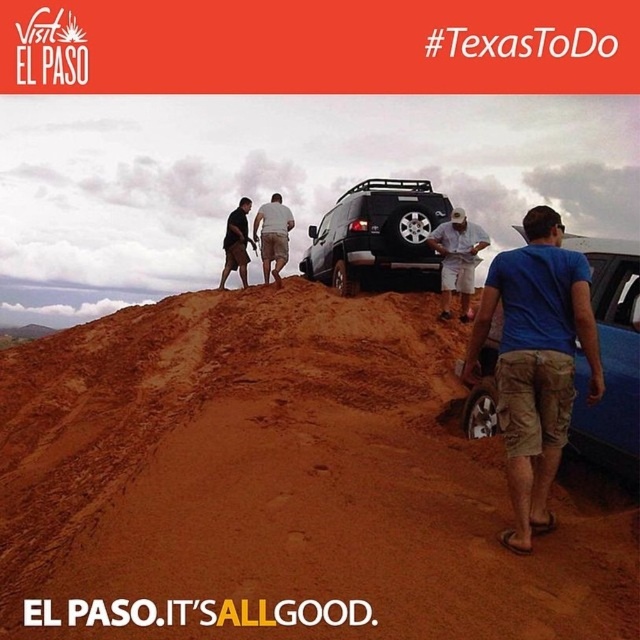
You are a photographer standing at the base of the hill. You want to take a photo that includes both the blue cotton shirt at upper right and the dark brown shorts at upper center. Which object should you focus on first to ensure both are in the frame?

You should focus on the blue cotton shirt at upper right first because it is closer to the viewer than the dark brown shorts at upper center, ensuring both are in the frame.